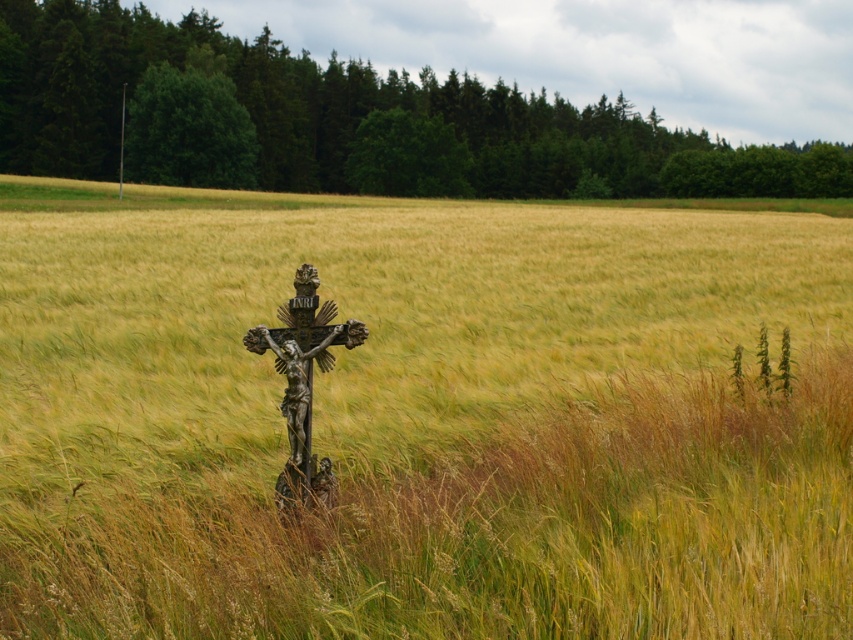
Is point (576, 250) less distant than point (302, 266)?

No, it is not.

Does golden wheat field at center have a lesser height compared to bronze crucifix at center?

In fact, golden wheat field at center may be taller than bronze crucifix at center.

Between point (299, 611) and point (305, 324), which one is positioned in front?

Point (299, 611) is more forward.

The image size is (853, 640). I want to click on golden wheat field at center, so click(421, 419).